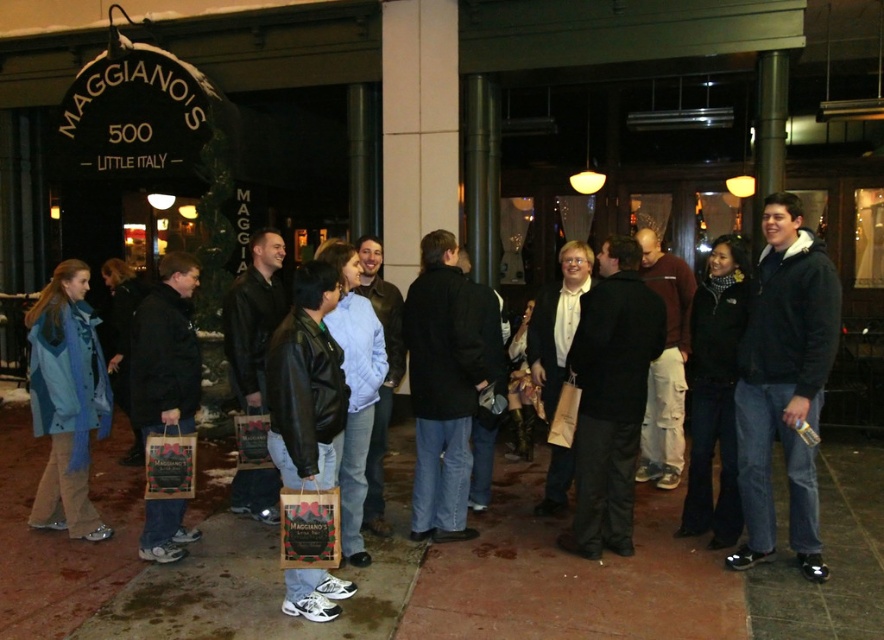
Question: Does matte black jacket at center lie in front of leather jacket at center?

Choices:
 (A) no
 (B) yes

Answer: (A)

Question: Is matte black jacket at center below leather jacket at center?

Choices:
 (A) no
 (B) yes

Answer: (B)

Question: Can you confirm if matte black jacket at center is positioned to the right of leather jacket at center?

Choices:
 (A) yes
 (B) no

Answer: (A)

Question: Which object is closer to the camera taking this photo?

Choices:
 (A) leather jacket at center
 (B) matte black jacket at center

Answer: (A)